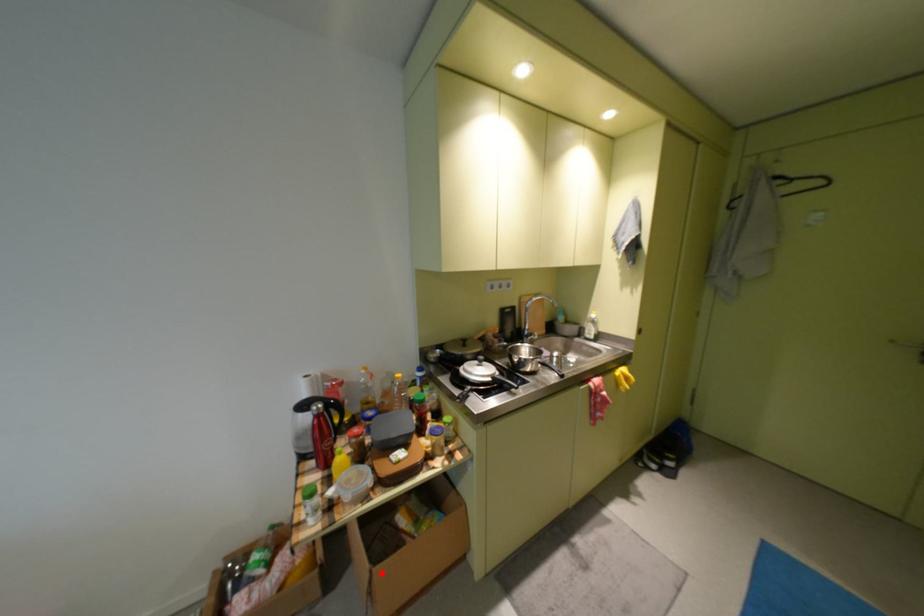
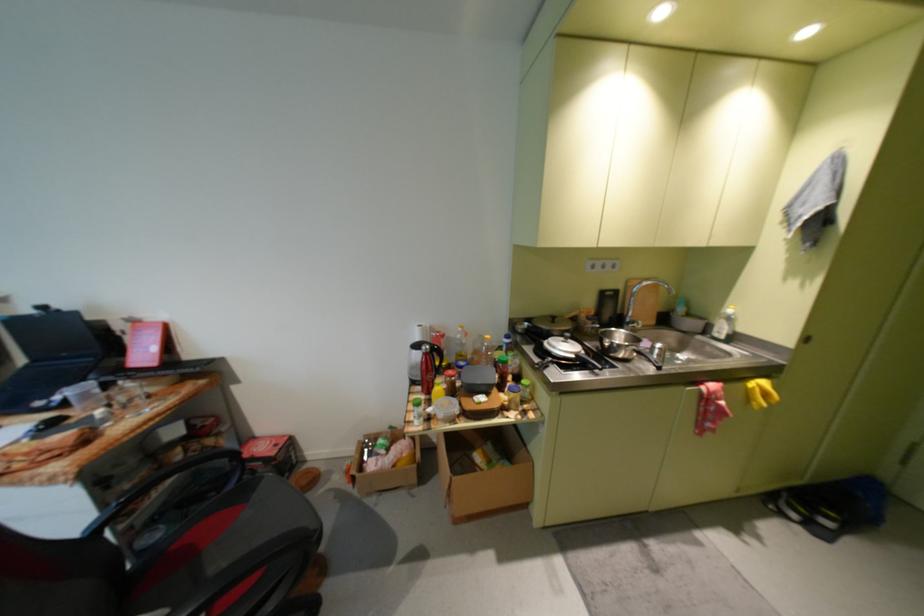
Where in the second image is the point corresponding to the highlighted location from the first image?

(462, 480)